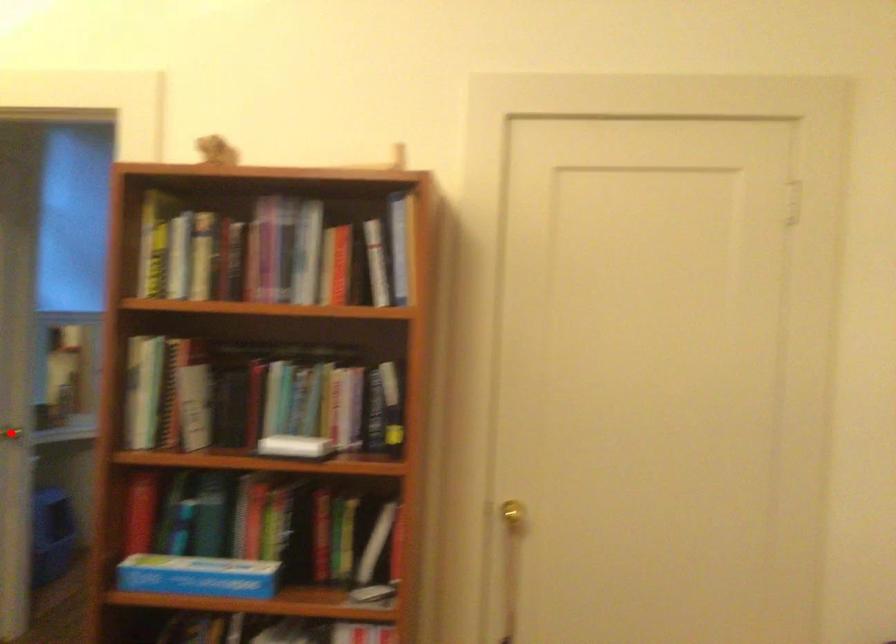
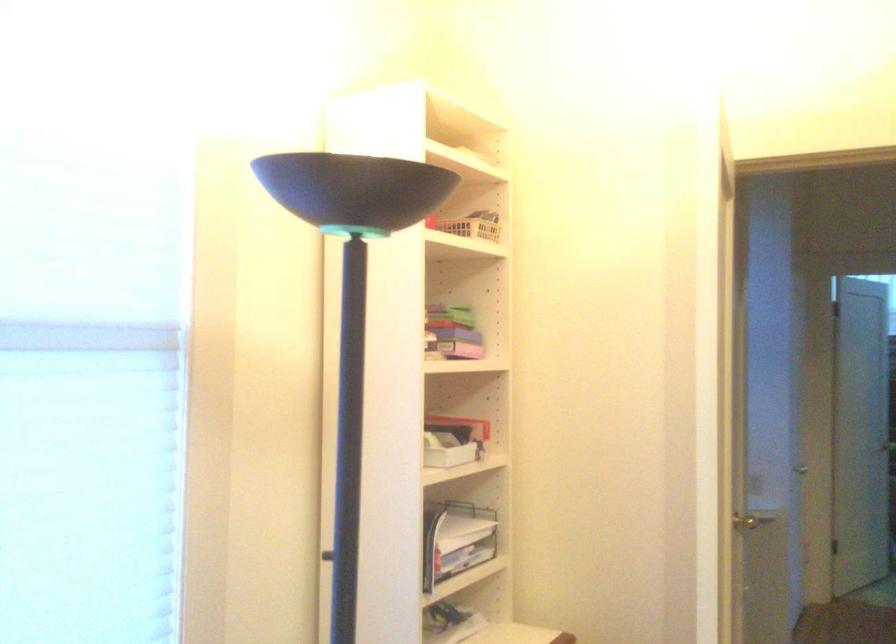
Find the pixel in the second image that matches the highlighted location in the first image.

(773, 531)